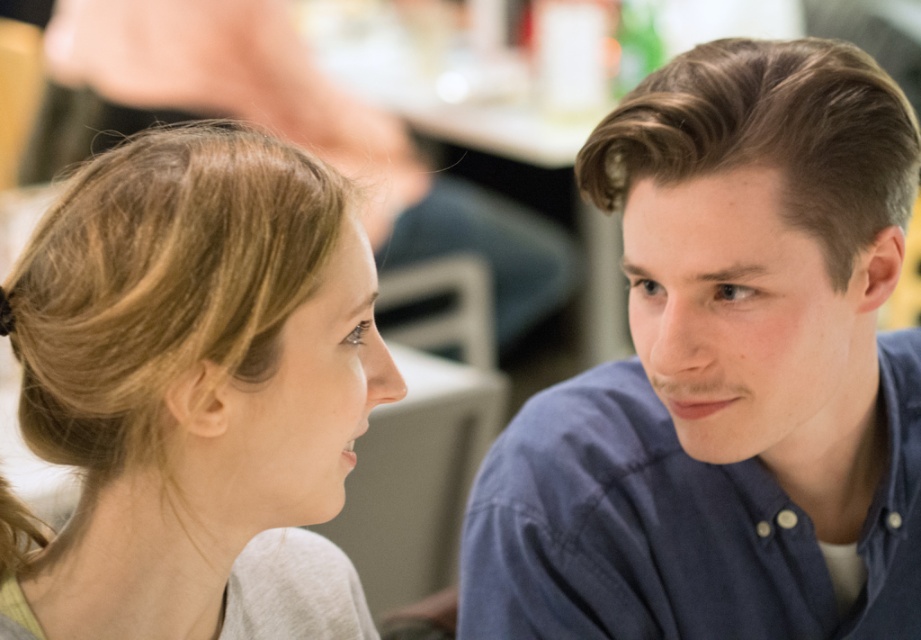
You are standing in the room and want to place a small decorative item exactly at the location marked by the coordinates point (725,372). Which object from the scene should you avoid placing the item near to prevent blocking it?

You should avoid placing the item near the blue cotton shirt at right because the coordinates point (725,372) is where the blue cotton shirt at right is located.

You are a photographer who wants to take a picture of the two people in the scene. If you move the person with the blue cotton shirt at right closer to the person with the blonde hair at left, will their positions overlap?

The blue cotton shirt at right is currently to the right of the blonde hair at left. Moving the blue cotton shirt at right closer to the blonde hair at left would bring them closer but their positions would not overlap as they are separate individuals.

Consider the image. You are a photographer who wants to ensure that the blue cotton shirt at right and the blonde hair at left are both clearly visible in the photo. Based on their heights, which object should you focus on to ensure proper depth of field?

The blue cotton shirt at right is taller than the blonde hair at left. To ensure both are in focus, focus on the blue cotton shirt at right since it is the taller object and occupies more vertical space.